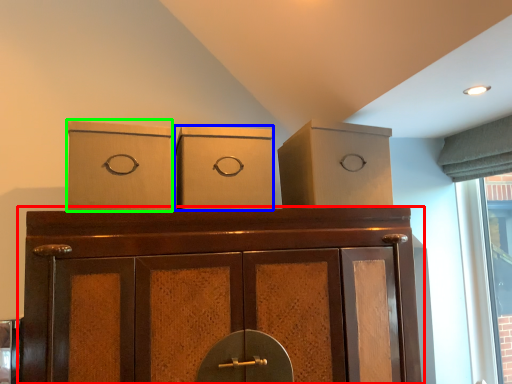
Question: Which object is the closest to the cupboard (highlighted by a red box)? Choose among these: cardboard box (highlighted by a blue box) or cardboard box (highlighted by a green box).

Choices:
 (A) cardboard box
 (B) cardboard box

Answer: (A)